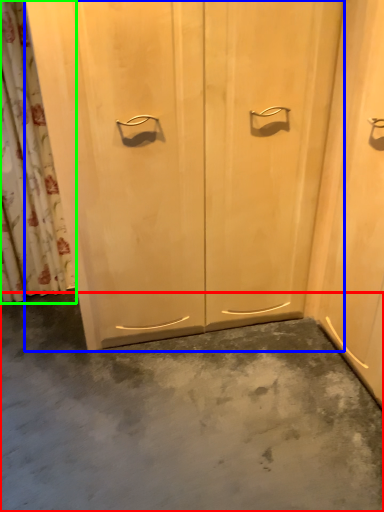
Question: Which is farther away from concrete (highlighted by a red box)? door (highlighted by a blue box) or shower curtain (highlighted by a green box)?

Choices:
 (A) door
 (B) shower curtain

Answer: (B)